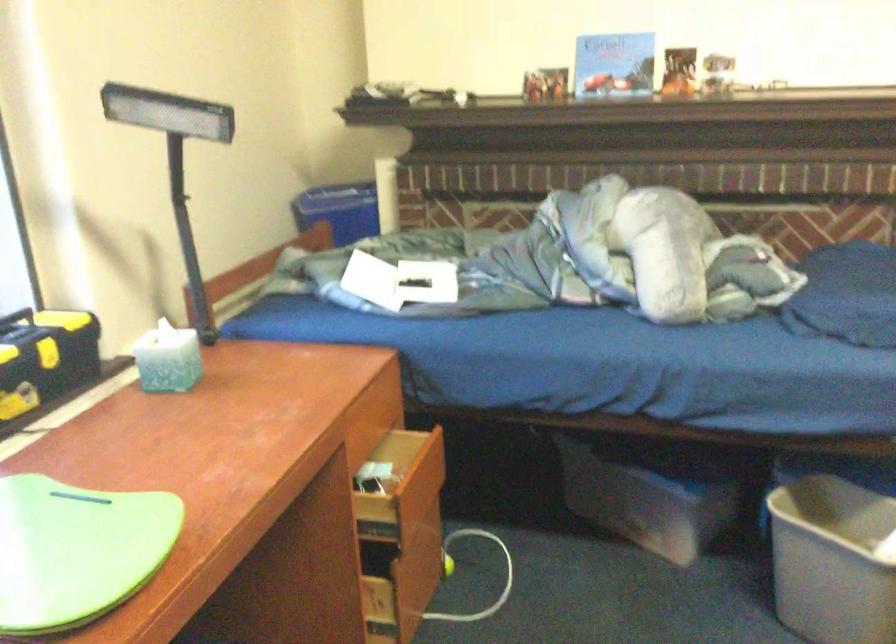
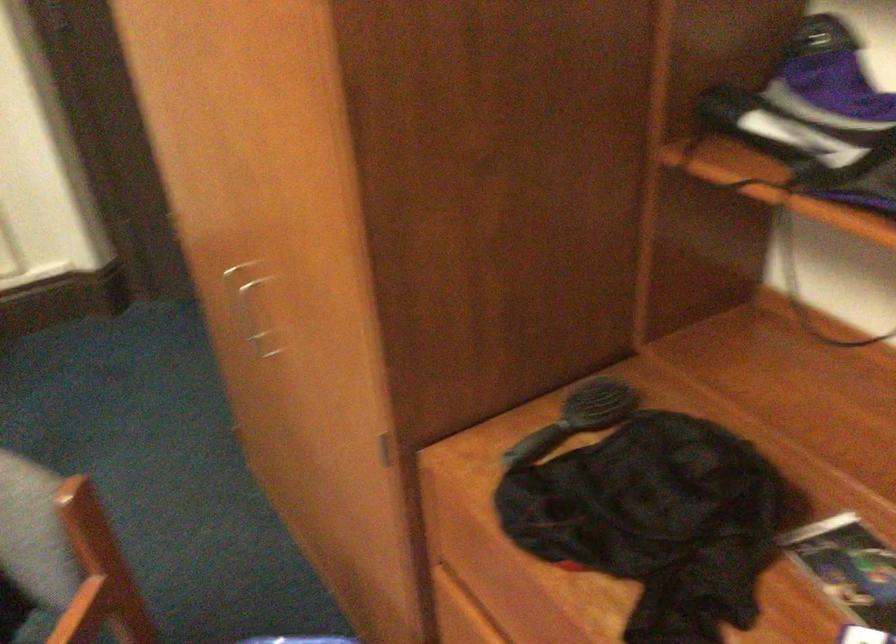
First-person continuous shooting, in which direction is the camera rotating?

The camera's rotation is toward right-down.